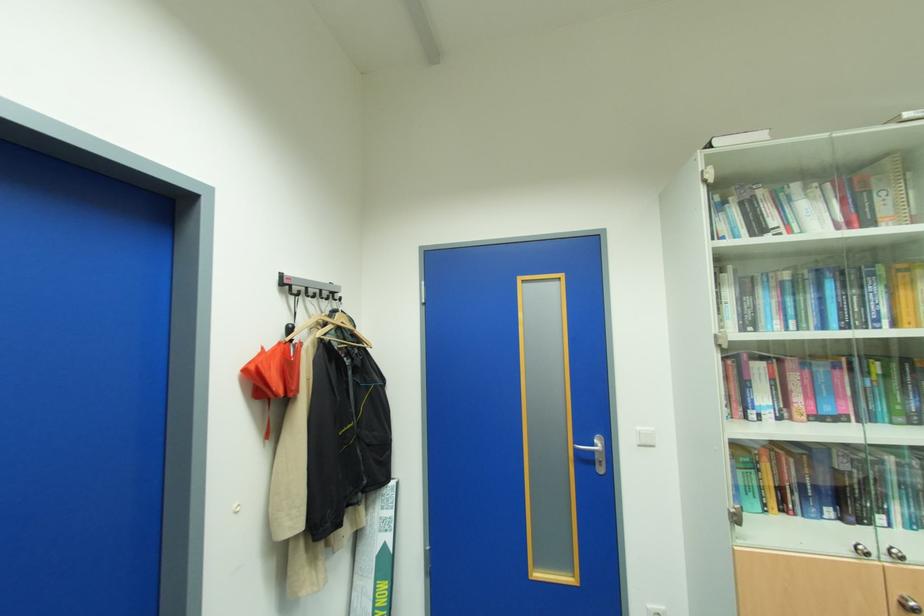
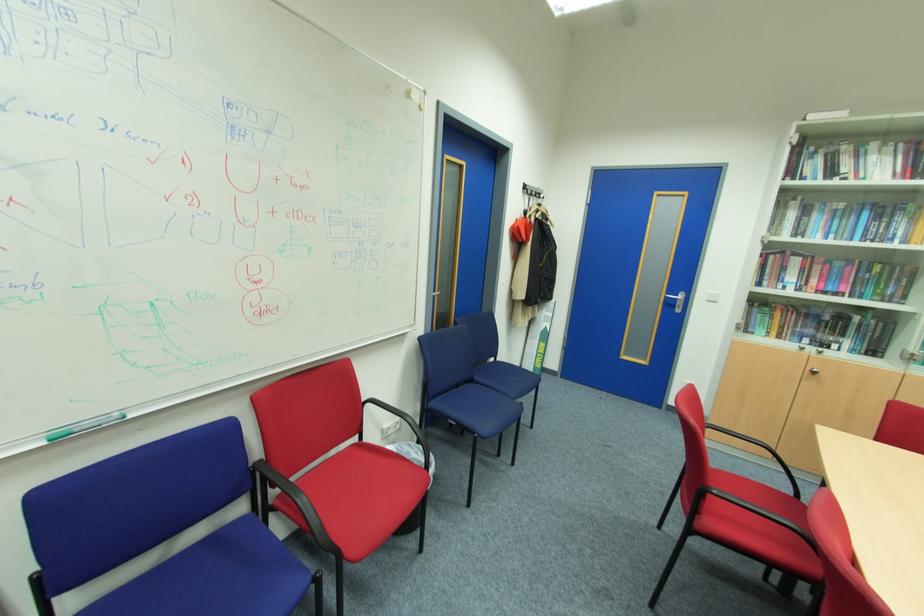
Question: The images are taken continuously from a first-person perspective. In which direction are you moving?

Choices:
 (A) Left
 (B) Right
 (C) Forward
 (D) Backward

Answer: (D)